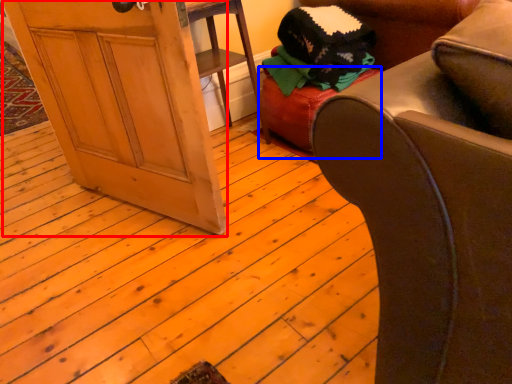
Question: Which of the following is the farthest to the observer, screen door (highlighted by a red box) or stool (highlighted by a blue box)?

Choices:
 (A) screen door
 (B) stool

Answer: (B)